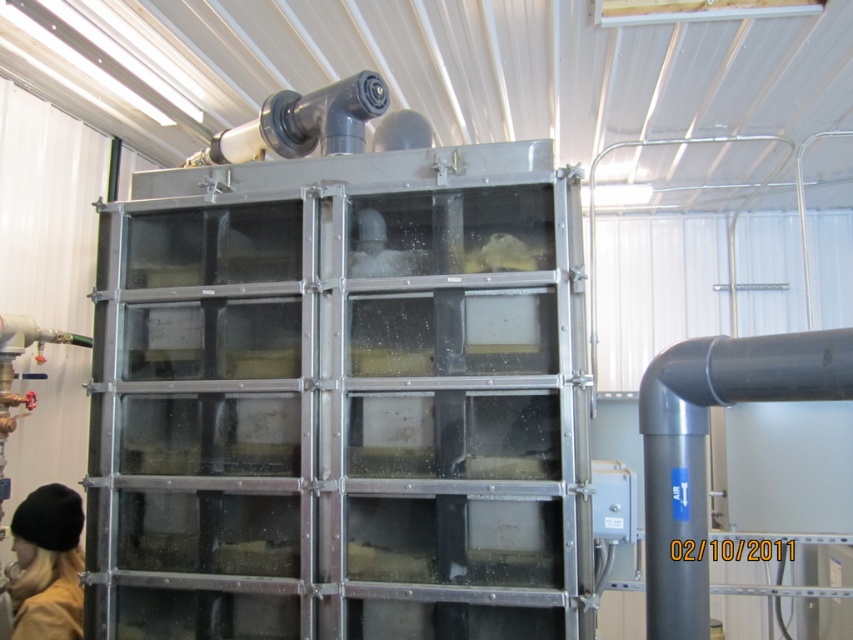
You are an inspector in the facility and need to determine if the black knit hat at lower left can be placed on top of the matte black pipe at upper center. Based on their heights, is this possible?

The black knit hat at lower left is much taller than the matte black pipe at upper center, so placing it on top would not be feasible due to its height.

You are an inspector in the facility and need to compare the sizes of the black knit hat at lower left and the matte black pipe at upper center. Which object is larger?

The matte black pipe at upper center is larger than the black knit hat at lower left.

You are an engineer standing in front of the industrial tank and notice the black knit hat at lower left. If you want to retrieve it without moving from your current position, can you reach it with a 2.5 meter long pole?

The black knit hat at lower left is 2.33 meters away from the camera, so yes, a 2.5 meter long pole would be sufficient to reach it.